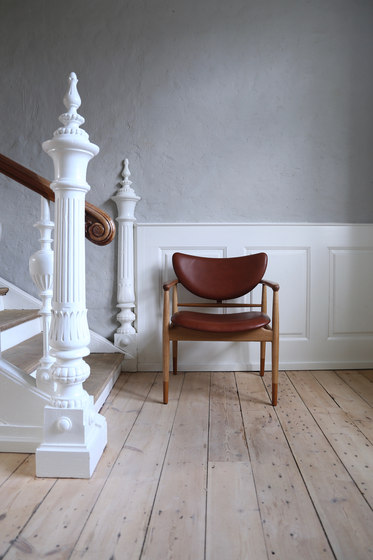
Locate an element on the screen. This screenshot has width=373, height=560. place where you sit is located at coordinates (225, 326).